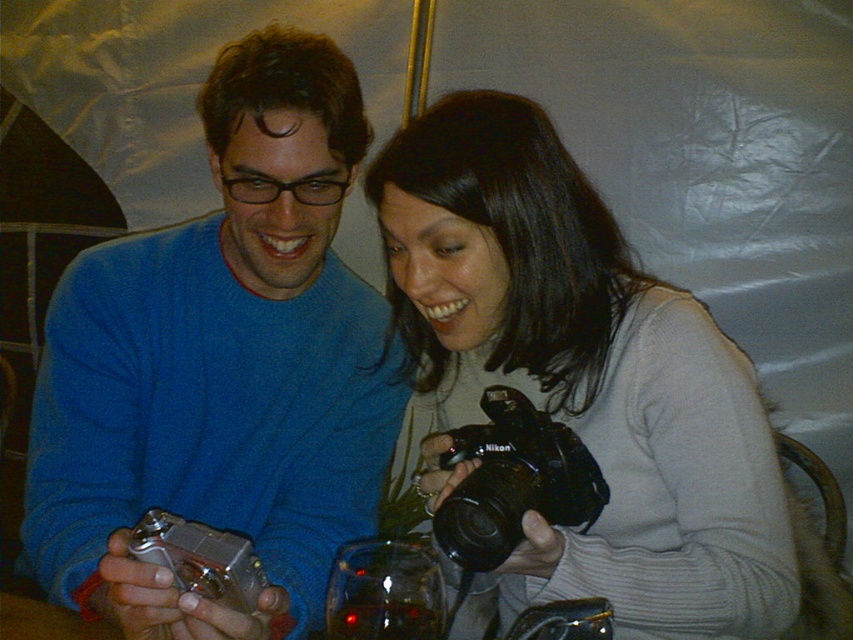
Who is shorter, matte black camera at center or silver metallic digital camera at lower left?

Standing shorter between the two is silver metallic digital camera at lower left.

Does matte black camera at center have a lesser width compared to silver metallic digital camera at lower left?

Incorrect, matte black camera at center's width is not less than silver metallic digital camera at lower left's.

Is point (665, 556) less distant than point (251, 595)?

No, it is behind (251, 595).

Identify the location of matte black camera at center. (585, 374).

Can you confirm if matte black camera at center is bigger than black plastic camera at center?

Correct, matte black camera at center is larger in size than black plastic camera at center.

Who is positioned more to the right, matte black camera at center or black plastic camera at center?

black plastic camera at center is more to the right.

Which is in front, point (498, 120) or point (556, 468)?

Positioned in front is point (556, 468).

Locate an element on the screen. Image resolution: width=853 pixels, height=640 pixels. matte black camera at center is located at coordinates (585, 374).

Which of these two, matte blue sweater at center or silver metallic digital camera at lower left, stands shorter?

silver metallic digital camera at lower left

Is point (117, 323) behind point (155, 557)?

Yes, it is behind point (155, 557).

This screenshot has width=853, height=640. I want to click on matte blue sweater at center, so click(222, 365).